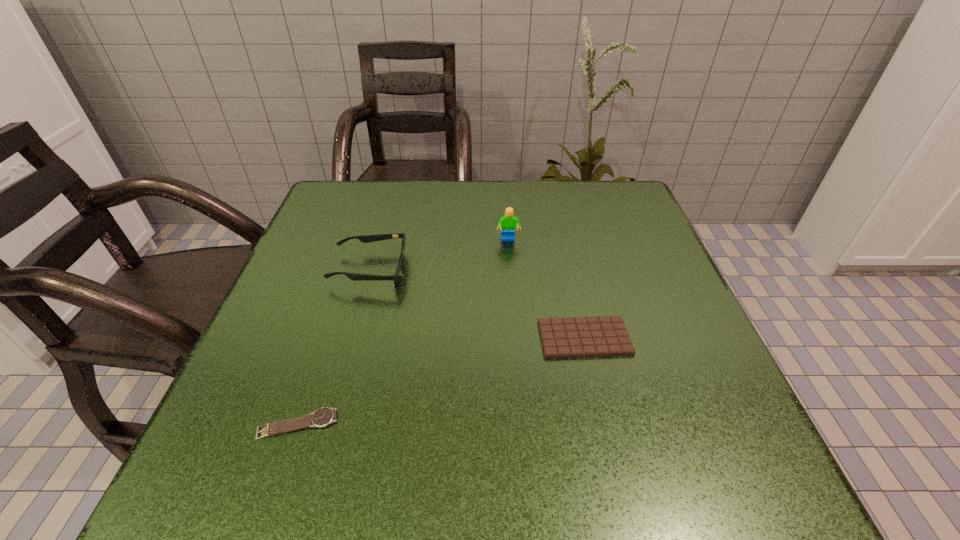
Where is `empty space between the shortest object and the second shortest object`? This screenshot has height=540, width=960. empty space between the shortest object and the second shortest object is located at coordinates (442, 381).

Identify the location of unoccupied position between the second farthest object and the nearest object. Image resolution: width=960 pixels, height=540 pixels. (334, 347).

This screenshot has height=540, width=960. I want to click on vacant area that lies between the second nearest object and the shortest object, so click(x=442, y=381).

Image resolution: width=960 pixels, height=540 pixels. Identify the location of empty space between the sunglasses and the watch. (334, 347).

Locate which object ranks third in proximity to the rightmost object. Please provide its 2D coordinates. Your answer should be formatted as a tuple, i.e. [(x, y)], where the tuple contains the x and y coordinates of a point satisfying the conditions above.

[(324, 416)]

Select which object is the closest to the rightmost object. Please provide its 2D coordinates. Your answer should be formatted as a tuple, i.e. [(x, y)], where the tuple contains the x and y coordinates of a point satisfying the conditions above.

[(508, 222)]

Image resolution: width=960 pixels, height=540 pixels. I want to click on free location that satisfies the following two spatial constraints: 1. on the back side of the chocolate bar; 2. on the front-facing side of the second farthest object, so click(569, 269).

Find the location of a particular element. Image resolution: width=960 pixels, height=540 pixels. free space that satisfies the following two spatial constraints: 1. on the face of the third farthest object; 2. on the right side of the tallest object is located at coordinates (516, 338).

Where is `free location that satisfies the following two spatial constraints: 1. on the back side of the second nearest object; 2. on the front-facing side of the second tallest object`? free location that satisfies the following two spatial constraints: 1. on the back side of the second nearest object; 2. on the front-facing side of the second tallest object is located at coordinates (569, 269).

Image resolution: width=960 pixels, height=540 pixels. I want to click on free space that satisfies the following two spatial constraints: 1. on the front-facing side of the sunglasses; 2. on the back side of the third tallest object, so click(x=350, y=338).